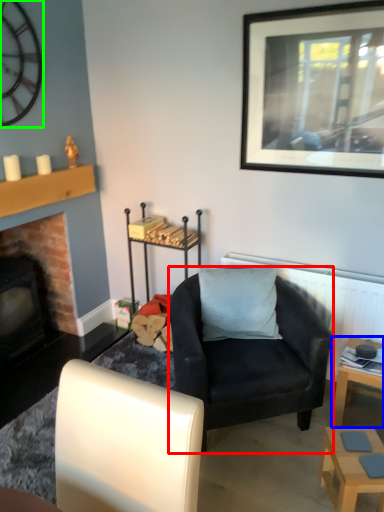
Question: Which object is positioned farthest from chair (highlighted by a red box)? Select from table (highlighted by a blue box) and clock (highlighted by a green box).

Choices:
 (A) table
 (B) clock

Answer: (B)